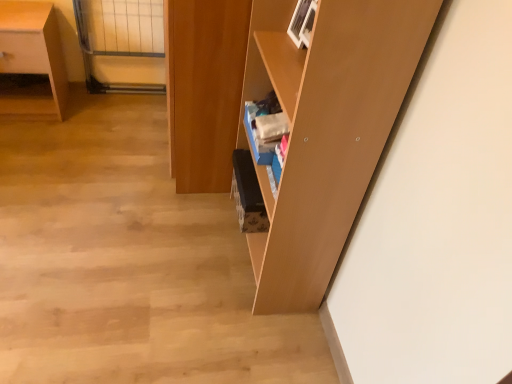
Where is `free space in front of wooden cabinet at center`? This screenshot has width=512, height=384. free space in front of wooden cabinet at center is located at coordinates (145, 228).